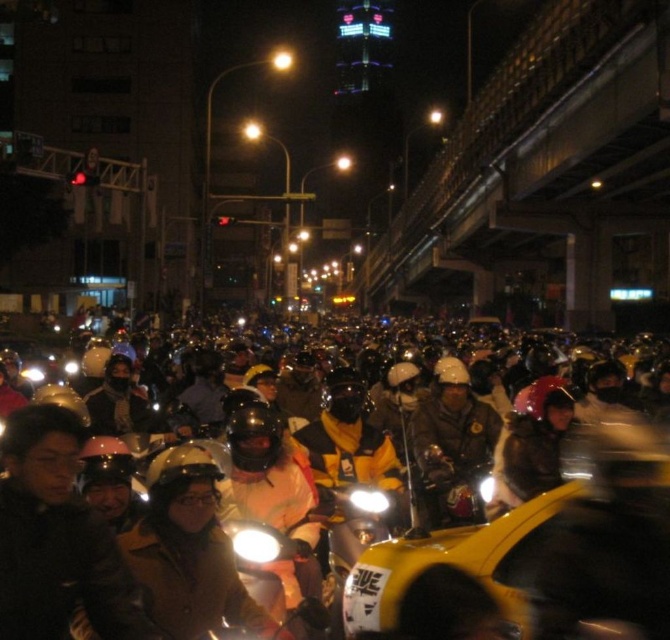
You are a delivery person standing at the camera position and need to deliver a package to the metallic silver motorcycle at center. The delivery zone requires you to be within 50 feet to scan the QR code. Can you scan the QR code from your current position?

The metallic silver motorcycle at center is 56.90 feet away from the camera, which is beyond the 50 feet requirement. Therefore, you cannot scan the QR code from your current position and need to move closer.

You are a pedestrian standing on the sidewalk observing the metallic silver motorcycle at center and the matte white headlight at center. Which object is closer to the left side of the sidewalk?

The matte white headlight at center is closer to the left side of the sidewalk because the metallic silver motorcycle at center is positioned on the right side of it.